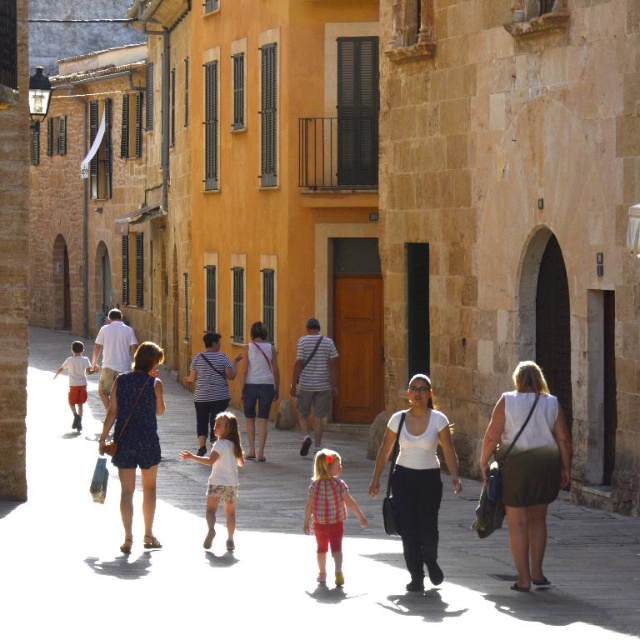
Looking at this image, you are a photographer trying to capture a candid shot of the matte white people at center and the plaid fabric shirt at center in the Mediterranean street scene. Since you want to ensure both subjects are in focus, which one should you focus on first to account for their positions?

The matte white people at center is positioned under the plaid fabric shirt at center, so you should focus on the plaid fabric shirt at center first as it is closer to the camera.

You are a photographer standing on the cobblestone street in the Mediterranean town. You see the matte white people at center and the white cotton shirt at center. Which one is positioned to the left of the other?

The matte white people at center is to the left of white cotton shirt at center according to the description.